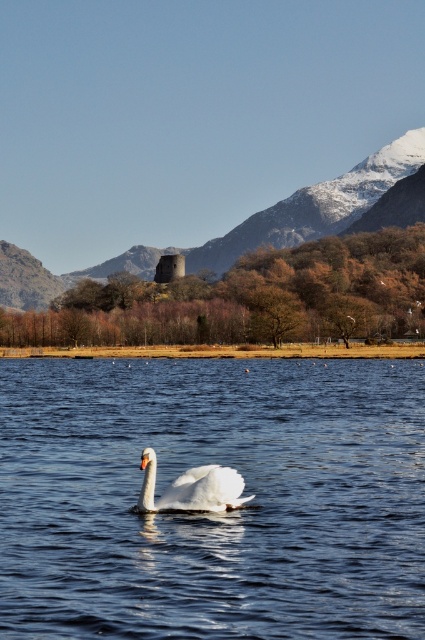
Question: Based on their relative distances, which object is farther from the clear blue water at center?

Choices:
 (A) smooth stone tower at center
 (B) white glossy swan at center

Answer: (A)

Question: Considering the relative positions of smooth stone tower at center and white glossy swan at center in the image provided, where is smooth stone tower at center located with respect to white glossy swan at center?

Choices:
 (A) right
 (B) left

Answer: (B)

Question: From the image, what is the correct spatial relationship of clear blue water at center in relation to white glossy swan at center?

Choices:
 (A) left
 (B) right

Answer: (A)

Question: Among these objects, which one is nearest to the camera?

Choices:
 (A) white glossy swan at center
 (B) clear blue water at center
 (C) smooth stone tower at center

Answer: (B)

Question: Which object is the farthest from the smooth stone tower at center?

Choices:
 (A) white glossy swan at center
 (B) clear blue water at center

Answer: (A)

Question: Can you confirm if smooth stone tower at center is thinner than white glossy swan at center?

Choices:
 (A) yes
 (B) no

Answer: (B)